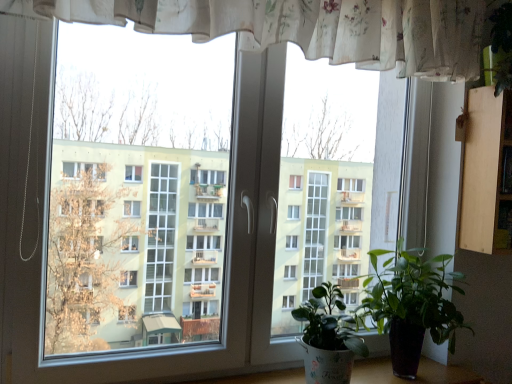
The width and height of the screenshot is (512, 384). I want to click on green glossy leafy plant at lower right, which is the second houseplant in right-to-left order, so click(328, 337).

This screenshot has height=384, width=512. What do you see at coordinates (328, 337) in the screenshot?
I see `green glossy leafy plant at lower right, which is the first houseplant from left to right` at bounding box center [328, 337].

How much space does green glossy leafy plant at lower right, which is the first houseplant from left to right, occupy vertically?

The height of green glossy leafy plant at lower right, which is the first houseplant from left to right, is 14.25 inches.

I want to click on green glossy plant at lower right, placed as the second houseplant when sorted from left to right, so click(411, 304).

This screenshot has height=384, width=512. What do you see at coordinates (411, 304) in the screenshot?
I see `green glossy plant at lower right, which ranks as the first houseplant in right-to-left order` at bounding box center [411, 304].

This screenshot has height=384, width=512. What are the coordinates of `green glossy leafy plant at lower right, which is the first houseplant from left to right` in the screenshot? It's located at (328, 337).

Is green glossy leafy plant at lower right, which is the second houseplant in right-to-left order, at the right side of green glossy plant at lower right, placed as the second houseplant when sorted from left to right?

Incorrect, green glossy leafy plant at lower right, which is the second houseplant in right-to-left order, is not on the right side of green glossy plant at lower right, placed as the second houseplant when sorted from left to right.

In the image, is green glossy leafy plant at lower right, which is the second houseplant in right-to-left order, positioned in front of or behind green glossy plant at lower right, placed as the second houseplant when sorted from left to right?

In the image, green glossy leafy plant at lower right, which is the second houseplant in right-to-left order, appears in front of green glossy plant at lower right, placed as the second houseplant when sorted from left to right.

Considering the positions of points (330, 366) and (415, 331), is point (330, 366) closer to camera compared to point (415, 331)?

That is True.

From the image's perspective, is green glossy leafy plant at lower right, which is the second houseplant in right-to-left order, located above or below green glossy plant at lower right, placed as the second houseplant when sorted from left to right?

green glossy leafy plant at lower right, which is the second houseplant in right-to-left order, is situated lower than green glossy plant at lower right, placed as the second houseplant when sorted from left to right, in the image.

From a real-world perspective, is green glossy leafy plant at lower right, which is the second houseplant in right-to-left order, beneath green glossy plant at lower right, placed as the second houseplant when sorted from left to right?

Indeed, from a real-world perspective, green glossy leafy plant at lower right, which is the second houseplant in right-to-left order, is positioned beneath green glossy plant at lower right, placed as the second houseplant when sorted from left to right.

Which of these two, green glossy leafy plant at lower right, which is the second houseplant in right-to-left order, or green glossy plant at lower right, placed as the second houseplant when sorted from left to right, is thinner?

green glossy leafy plant at lower right, which is the second houseplant in right-to-left order.

Which of these two, green glossy leafy plant at lower right, which is the second houseplant in right-to-left order, or green glossy plant at lower right, placed as the second houseplant when sorted from left to right, stands shorter?

Standing shorter between the two is green glossy leafy plant at lower right, which is the second houseplant in right-to-left order.

In terms of size, does green glossy leafy plant at lower right, which is the second houseplant in right-to-left order, appear bigger or smaller than green glossy plant at lower right, which ranks as the first houseplant in right-to-left order?

Considering their sizes, green glossy leafy plant at lower right, which is the second houseplant in right-to-left order, takes up less space than green glossy plant at lower right, which ranks as the first houseplant in right-to-left order.

Choose the correct answer: Is green glossy leafy plant at lower right, which is the first houseplant from left to right, inside green glossy plant at lower right, which ranks as the first houseplant in right-to-left order, or outside it?

green glossy leafy plant at lower right, which is the first houseplant from left to right, is spatially situated outside green glossy plant at lower right, which ranks as the first houseplant in right-to-left order.

Does green glossy leafy plant at lower right, which is the first houseplant from left to right, touch green glossy plant at lower right, which ranks as the first houseplant in right-to-left order?

They are not placed beside each other.

Is green glossy leafy plant at lower right, which is the second houseplant in right-to-left order, facing away from green glossy plant at lower right, which ranks as the first houseplant in right-to-left order?

No, green glossy leafy plant at lower right, which is the second houseplant in right-to-left order,'s orientation is not away from green glossy plant at lower right, which ranks as the first houseplant in right-to-left order.

How distant is green glossy leafy plant at lower right, which is the second houseplant in right-to-left order, from green glossy plant at lower right, placed as the second houseplant when sorted from left to right?

They are 8.57 inches apart.

Locate an element on the screen. houseplant above the green glossy leafy plant at lower right, which is the second houseplant in right-to-left order (from a real-world perspective) is located at coordinates (411, 304).

From the picture: Which is more to the left, green glossy plant at lower right, which ranks as the first houseplant in right-to-left order, or green glossy leafy plant at lower right, which is the second houseplant in right-to-left order?

From the viewer's perspective, green glossy leafy plant at lower right, which is the second houseplant in right-to-left order, appears more on the left side.

Is green glossy plant at lower right, placed as the second houseplant when sorted from left to right, closer to camera compared to green glossy leafy plant at lower right, which is the second houseplant in right-to-left order?

No, green glossy plant at lower right, placed as the second houseplant when sorted from left to right, is behind green glossy leafy plant at lower right, which is the second houseplant in right-to-left order.

Does point (438, 301) lie in front of point (313, 306)?

That is False.

From the image's perspective, between green glossy plant at lower right, which ranks as the first houseplant in right-to-left order, and green glossy leafy plant at lower right, which is the second houseplant in right-to-left order, which one is located above?

From the image's view, green glossy plant at lower right, which ranks as the first houseplant in right-to-left order, is above.

From a real-world perspective, does green glossy plant at lower right, which ranks as the first houseplant in right-to-left order, sit lower than green glossy leafy plant at lower right, which is the first houseplant from left to right?

No.

Consider the image. Which object is thinner, green glossy plant at lower right, which ranks as the first houseplant in right-to-left order, or green glossy leafy plant at lower right, which is the second houseplant in right-to-left order?

green glossy leafy plant at lower right, which is the second houseplant in right-to-left order, is thinner.

Considering the relative sizes of green glossy plant at lower right, which ranks as the first houseplant in right-to-left order, and green glossy leafy plant at lower right, which is the second houseplant in right-to-left order, in the image provided, is green glossy plant at lower right, which ranks as the first houseplant in right-to-left order, shorter than green glossy leafy plant at lower right, which is the second houseplant in right-to-left order,?

No.

Can you confirm if green glossy plant at lower right, which ranks as the first houseplant in right-to-left order, is bigger than green glossy leafy plant at lower right, which is the first houseplant from left to right?

Yes, green glossy plant at lower right, which ranks as the first houseplant in right-to-left order, is bigger than green glossy leafy plant at lower right, which is the first houseplant from left to right.

Would you say green glossy plant at lower right, placed as the second houseplant when sorted from left to right, is inside or outside green glossy leafy plant at lower right, which is the first houseplant from left to right?

green glossy plant at lower right, placed as the second houseplant when sorted from left to right, is located beyond the bounds of green glossy leafy plant at lower right, which is the first houseplant from left to right.

Is green glossy plant at lower right, which ranks as the first houseplant in right-to-left order, in contact with green glossy leafy plant at lower right, which is the first houseplant from left to right?

No, green glossy plant at lower right, which ranks as the first houseplant in right-to-left order, is not touching green glossy leafy plant at lower right, which is the first houseplant from left to right.

Is green glossy plant at lower right, placed as the second houseplant when sorted from left to right, positioned with its back to green glossy leafy plant at lower right, which is the second houseplant in right-to-left order?

No, green glossy plant at lower right, placed as the second houseplant when sorted from left to right, is not facing the opposite direction of green glossy leafy plant at lower right, which is the second houseplant in right-to-left order.

What's the angular difference between green glossy plant at lower right, placed as the second houseplant when sorted from left to right, and green glossy leafy plant at lower right, which is the second houseplant in right-to-left order,'s facing directions?

There is a 0.000521-degree angle between the facing directions of green glossy plant at lower right, placed as the second houseplant when sorted from left to right, and green glossy leafy plant at lower right, which is the second houseplant in right-to-left order.

Locate an element on the screen. The image size is (512, 384). houseplant on the left of green glossy plant at lower right, which ranks as the first houseplant in right-to-left order is located at coordinates (328, 337).

Where is `houseplant on the left of green glossy plant at lower right, placed as the second houseplant when sorted from left to right`? houseplant on the left of green glossy plant at lower right, placed as the second houseplant when sorted from left to right is located at coordinates (328, 337).

This screenshot has height=384, width=512. I want to click on houseplant above the green glossy leafy plant at lower right, which is the first houseplant from left to right (from the image's perspective), so click(x=411, y=304).